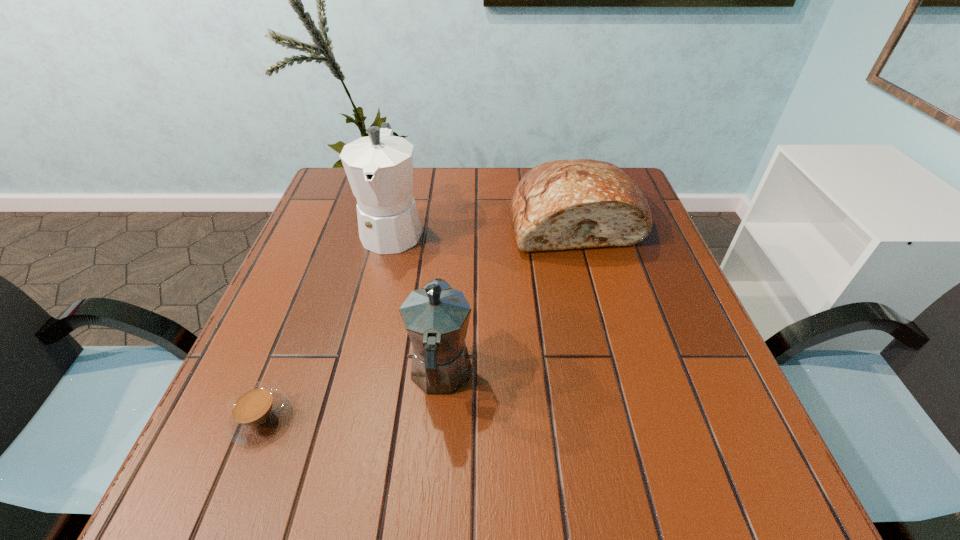
This screenshot has width=960, height=540. Identify the location of free space located 0.220m on the pouring side of the shorter coffeepot. (449, 262).

Identify the location of free space located 0.250m on the pouring side of the shorter coffeepot. (450, 254).

The width and height of the screenshot is (960, 540). I want to click on free space located 0.340m at the sliced front of the third tallest object, so click(618, 380).

You are a GUI agent. You are given a task and a screenshot of the screen. Output one action in this format:
    pyautogui.click(x=<x>, y=<y>)
    Task: Click on the vacant space located 0.090m on the back of the cappuccino
    This screenshot has width=960, height=540.
    Given the screenshot: What is the action you would take?
    pyautogui.click(x=288, y=350)

Locate an element on the screen. The image size is (960, 540). coffeepot that is at the far edge is located at coordinates (379, 167).

Where is `bread that is at the far edge`? Image resolution: width=960 pixels, height=540 pixels. bread that is at the far edge is located at coordinates (577, 203).

I want to click on coffeepot that is at the left edge, so click(x=379, y=167).

Image resolution: width=960 pixels, height=540 pixels. I want to click on cappuccino that is at the left edge, so click(256, 413).

This screenshot has width=960, height=540. Identify the location of object at the right edge. (577, 203).

This screenshot has width=960, height=540. Find the location of `object that is positioned at the far left corner`. object that is positioned at the far left corner is located at coordinates [x=379, y=167].